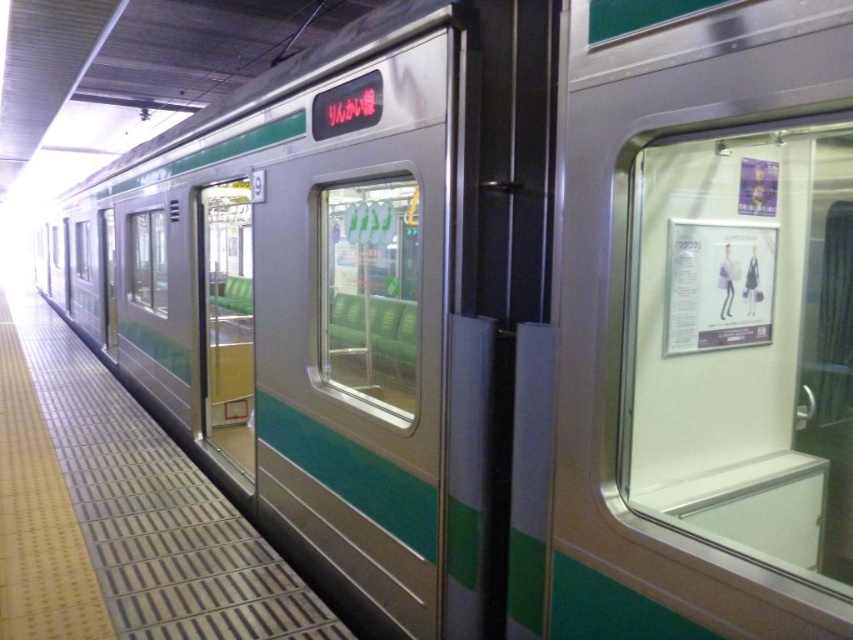
You are a maintenance worker who needs to place a 1.2 meter tall equipment on the smooth concrete platform at center. The green matte door at center is currently open. Will the equipment block the door when placed there?

The smooth concrete platform at center is taller than the green matte door at center. Since the equipment is 1.2 meters tall, placing it on the platform may block the door if the door is shorter than 1.2 meters. However, the platform itself is taller than the door, so the equipment placed on the platform could potentially block the door when it is open. To ensure safety, the equipment should be placed away from the door area.